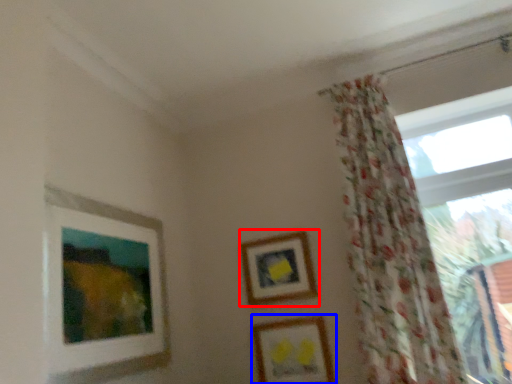
Question: Among these objects, which one is farthest to the camera, picture frame (highlighted by a red box) or picture frame (highlighted by a blue box)?

Choices:
 (A) picture frame
 (B) picture frame

Answer: (A)